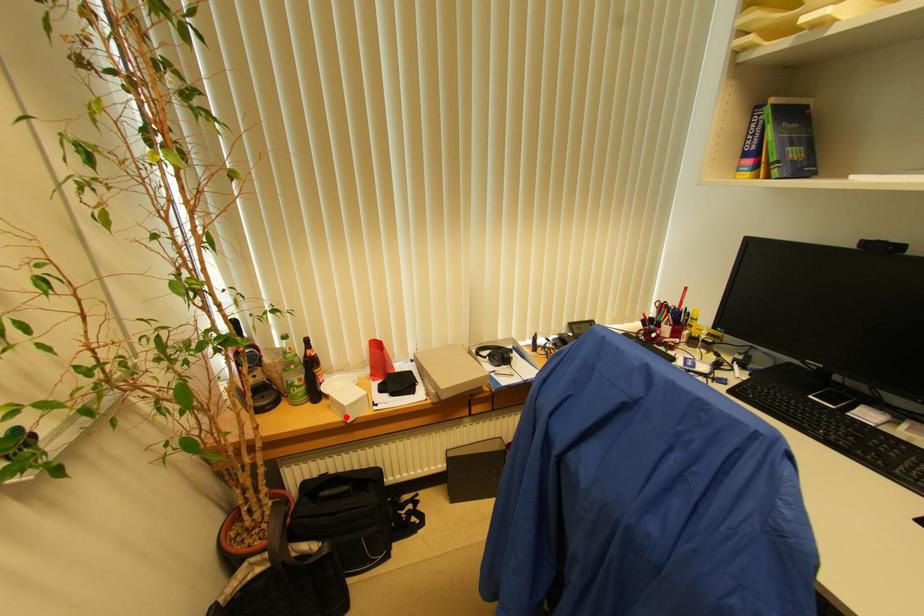
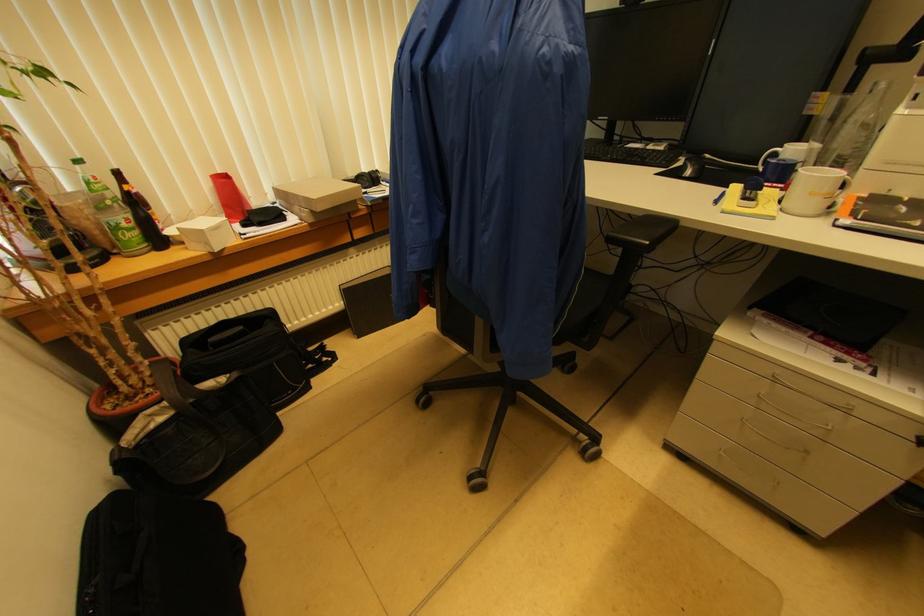
Question: I am providing you with two images of the same scene from different viewpoints. In image1, a red point is highlighted. Considering the same 3D point in image2, which of the following is correct?

Choices:
 (A) It is closer
 (B) It is farther

Answer: (A)